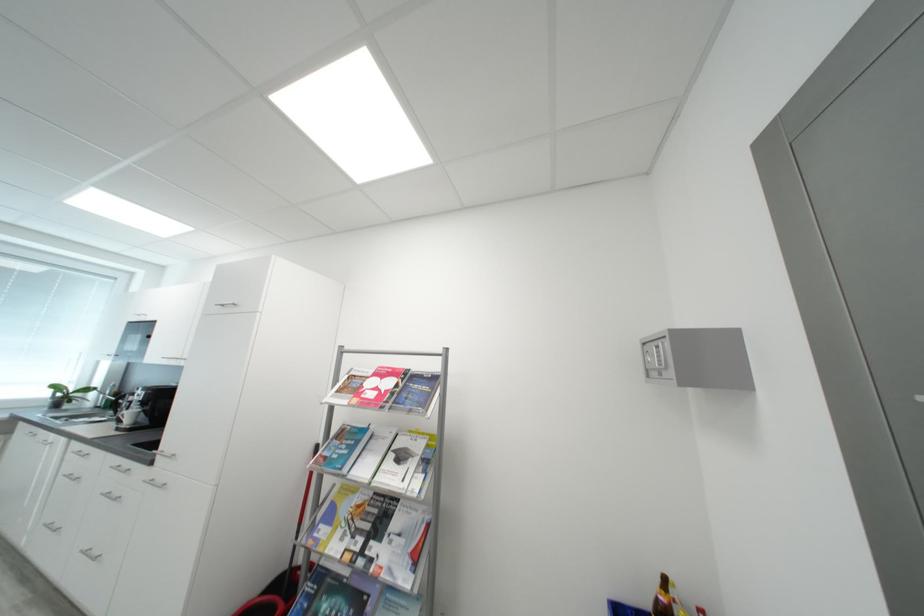
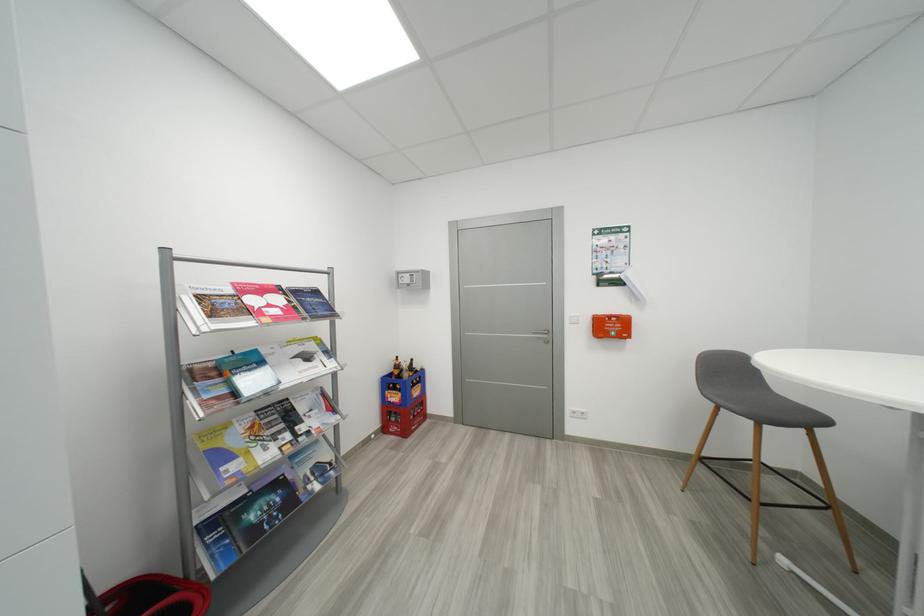
The point at (660, 361) is marked in the first image. Where is the corresponding point in the second image?

(412, 282)